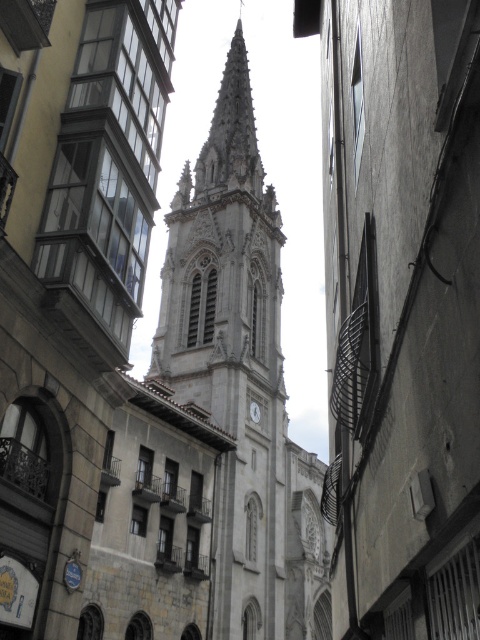
Between point (244, 278) and point (251, 403), which one is positioned behind?

The point (244, 278) is behind.

The height and width of the screenshot is (640, 480). I want to click on white stone tower at center, so click(241, 380).

What are the coordinates of `white stone tower at center` in the screenshot? It's located at (241, 380).